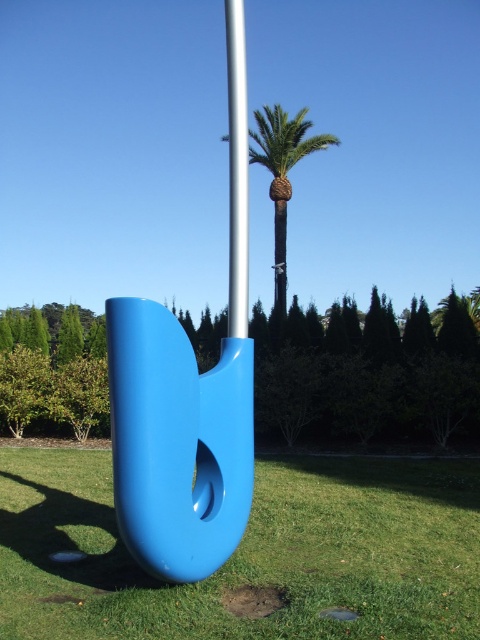
Question: Does green leafy tree at center appear over glossy plastic sculpture at center?

Choices:
 (A) no
 (B) yes

Answer: (A)

Question: Among these points, which one is farthest from the camera?

Choices:
 (A) (229, 177)
 (B) (212, 512)

Answer: (A)

Question: Which point appears closest to the camera in this image?

Choices:
 (A) (371, 326)
 (B) (316, 138)
 (C) (116, 328)
 (D) (242, 65)

Answer: (C)

Question: Considering the real-world distances, which object is closest to the silver metallic pole at center?

Choices:
 (A) green leafy tree at center
 (B) green leafy palm at center

Answer: (A)

Question: Does green grass at lower center appear on the right side of green leafy tree at center?

Choices:
 (A) no
 (B) yes

Answer: (B)

Question: Does green leafy tree at center appear on the right side of silver metallic pole at center?

Choices:
 (A) no
 (B) yes

Answer: (A)